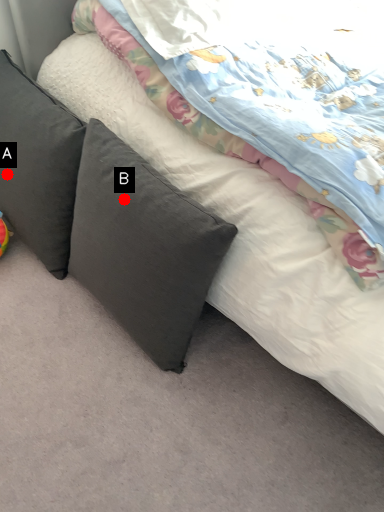
Question: Two points are circled on the image, labeled by A and B beside each circle. Which point is farther from the camera taking this photo?

Choices:
 (A) A is further
 (B) B is further

Answer: (A)